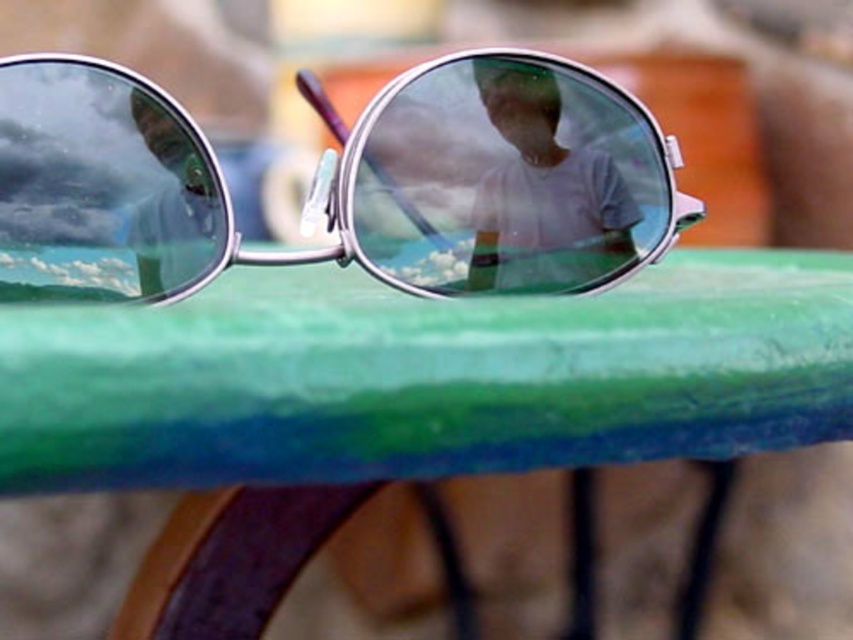
You are a photographer trying to capture a reflection in the metallic round goggles at center. To ensure the matte white shirt at center is visible in the reflection, where should you position yourself relative to the goggles?

The metallic round goggles at center are in front of the matte white shirt at center. To see the shirt in the reflection, you should position yourself behind the goggles, facing the shirt so that the goggles reflect the shirt towards your camera.

Consider the image. You are trying to place a small sticker between the metallic round goggles at center and the matte white shirt at center. Based on their positions, would you place the sticker to the left or right of the goggles?

You should place the sticker to the right of the metallic round goggles at center because the goggles are to the left of the matte white shirt at center, meaning the shirt is to the right of the goggles.